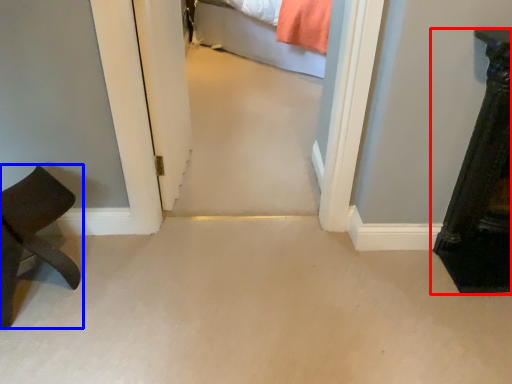
Question: Among these objects, which one is farthest to the camera, furniture (highlighted by a red box) or furniture (highlighted by a blue box)?

Choices:
 (A) furniture
 (B) furniture

Answer: (A)